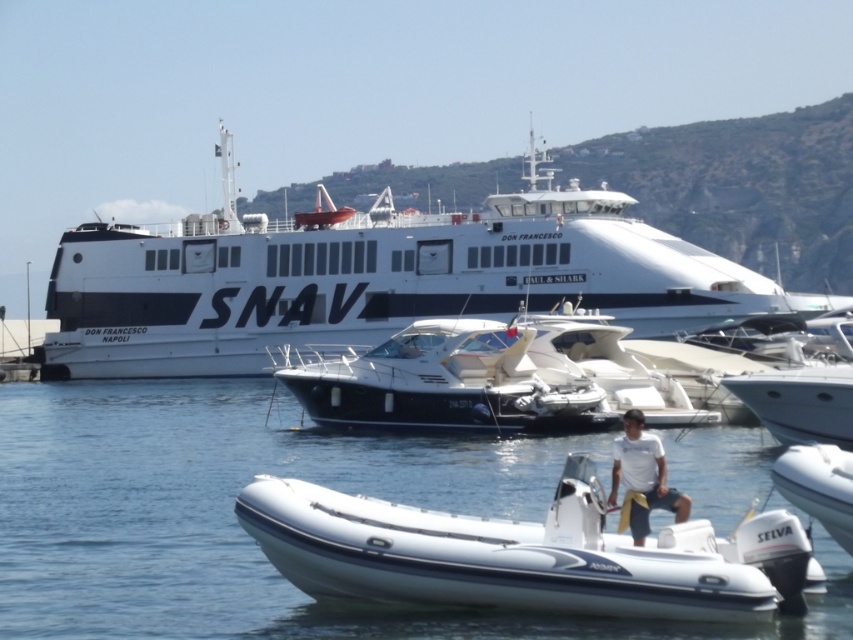
What is the object located at the coordinates point (242, 529) in the image?

The point (242, 529) marks the white rubber boat at center.

You are a photographer trying to capture a clear shot of the white cotton shirt at center from above. The white rubber boat at center is in the way. Can you tell me if the boat is taller than the shirt?

The white rubber boat at center has a greater height compared to the white cotton shirt at center, so yes, the boat is taller than the shirt and will block the view from above.

You are a photographer standing at the edge of the marina. You want to take a photo of the white rubber dinghy at center. Considering the distance, will you need a zoom lens to capture the entire dinghy in the frame?

The white rubber dinghy at center is 35.03 meters away from the camera. A zoom lens would be necessary to capture the entire dinghy in the frame from that distance.